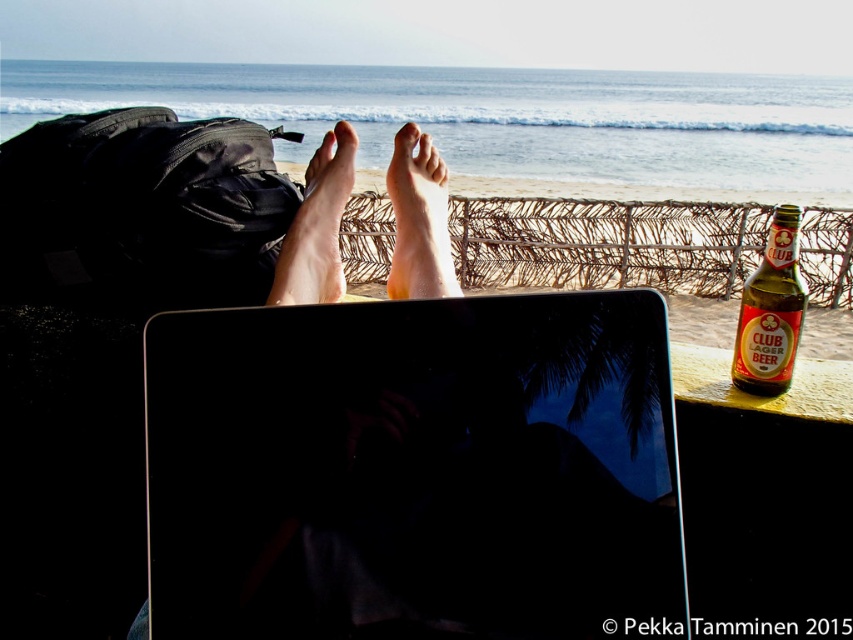
Can you confirm if black glossy laptop at center is positioned to the left of pale skin foot at center?

No, black glossy laptop at center is not to the left of pale skin foot at center.

Between black glossy laptop at center and pale skin foot at center, which one has less height?

With less height is black glossy laptop at center.

Locate an element on the screen. black glossy laptop at center is located at coordinates (415, 470).

Can you confirm if green glass bottle at right is smaller than pale skin foot at center?

Correct, green glass bottle at right occupies less space than pale skin foot at center.

Looking at this image, measure the distance between green glass bottle at right and pale skin foot at center.

green glass bottle at right and pale skin foot at center are 64.99 centimeters apart from each other.

Between point (796, 272) and point (281, 304), which one is positioned behind?

The point (796, 272) is more distant.

At what (x,y) coordinates should I click in order to perform the action: click on green glass bottle at right. Please return your answer as a coordinate pair (x, y). Looking at the image, I should click on (770, 310).

Which is more to the left, dry skin foot at center or green glass bottle at right?

dry skin foot at center

Between dry skin foot at center and green glass bottle at right, which one is positioned higher?

dry skin foot at center is higher up.

Between point (413, 237) and point (746, 314), which one is positioned behind?

The point (746, 314) is more distant.

What are the coordinates of `dry skin foot at center` in the screenshot? It's located at (419, 220).